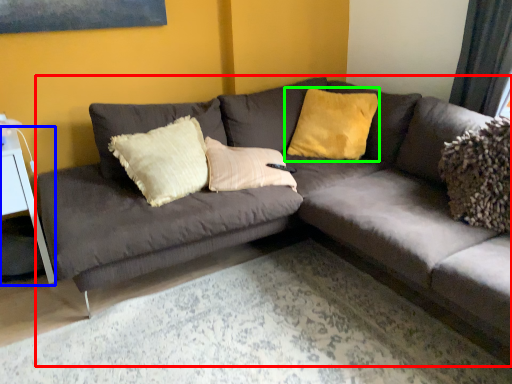
Question: Estimate the real-world distances between objects in this image. Which object is closer to studio couch (highlighted by a red box), table (highlighted by a blue box) or pillow (highlighted by a green box)?

Choices:
 (A) table
 (B) pillow

Answer: (B)